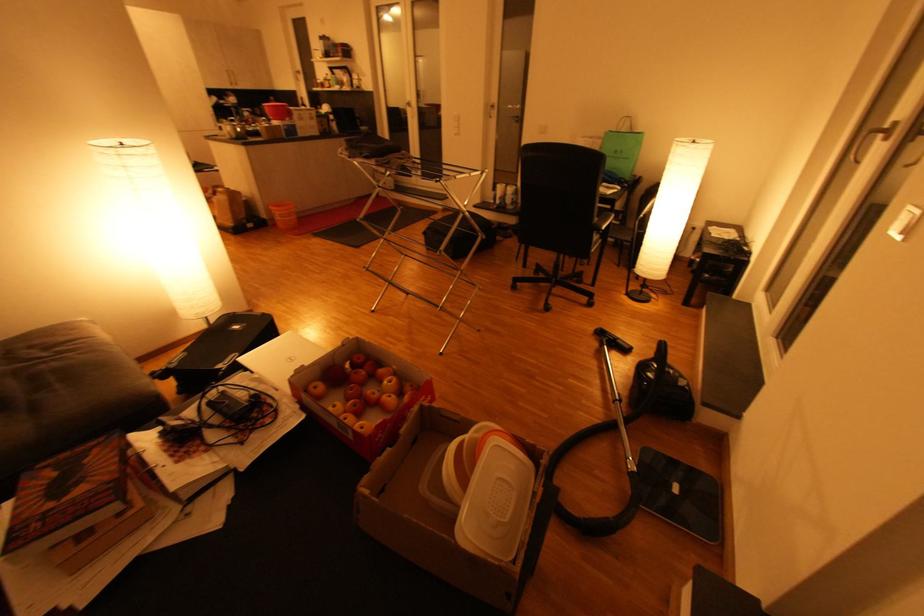
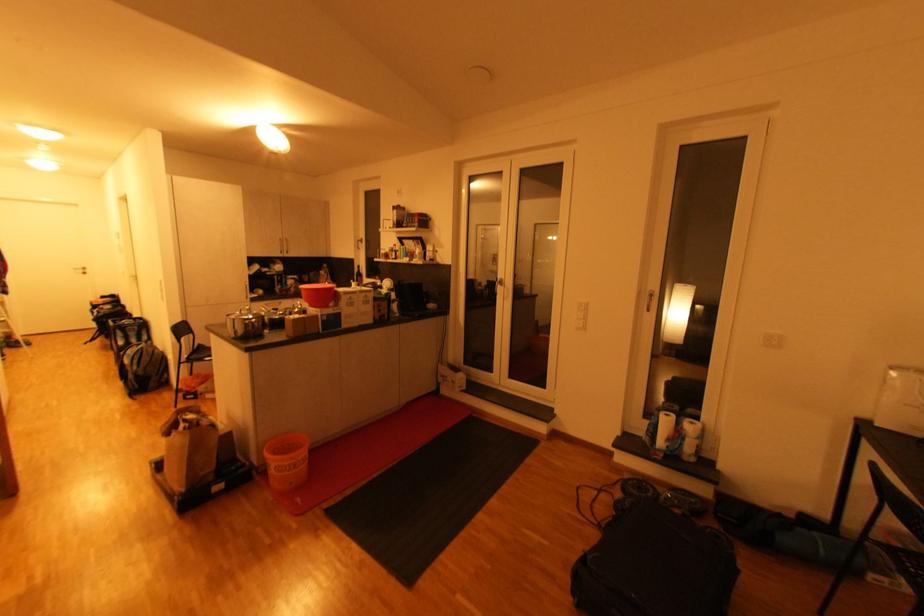
Find the pixel in the second image that matches the point at 238,137 in the first image.

(245, 334)